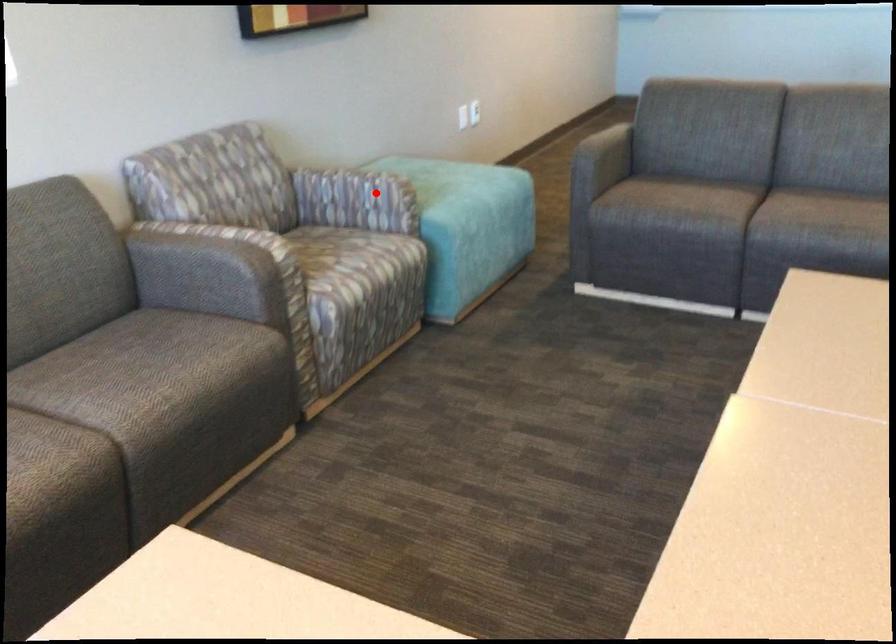
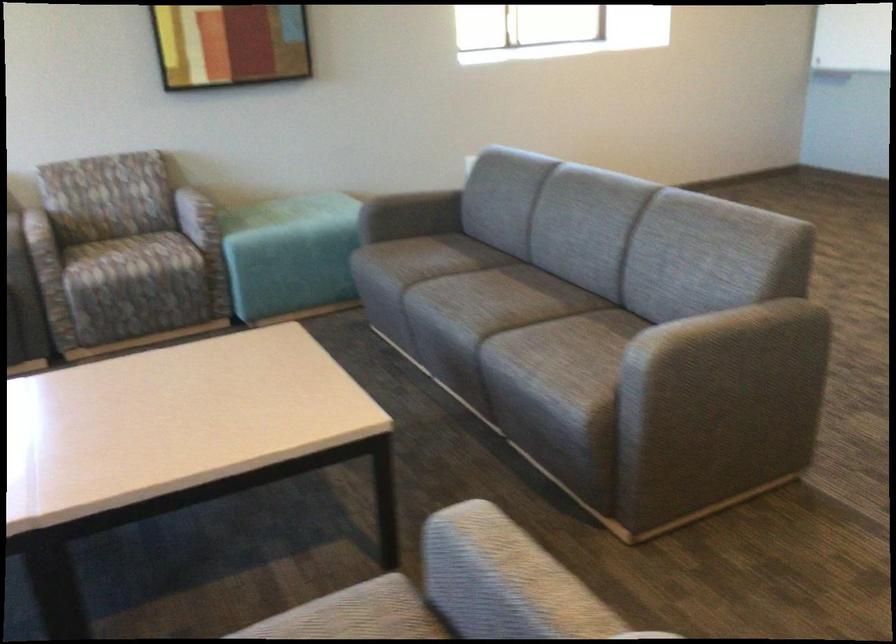
In the second image, find the point that corresponds to the highlighted location in the first image.

(197, 216)